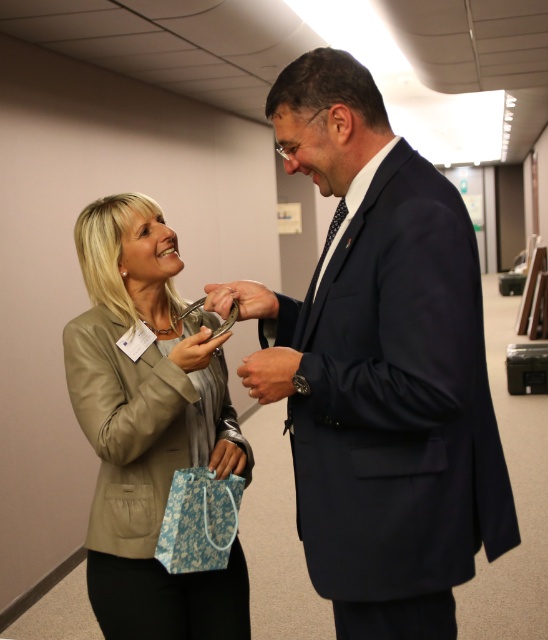
Is the position of navy blue suit at center more distant than that of beige leather jacket at left?

No.

Between navy blue suit at center and beige leather jacket at left, which one is positioned higher?

navy blue suit at center

Is point (412, 525) farther from camera compared to point (64, 332)?

No, it is not.

Locate an element on the screen. The width and height of the screenshot is (548, 640). navy blue suit at center is located at coordinates (379, 368).